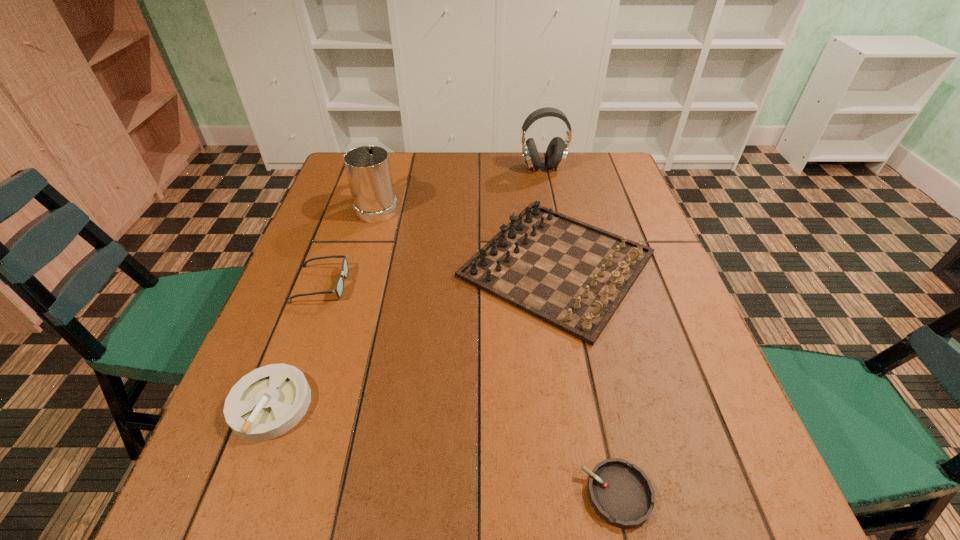
This screenshot has width=960, height=540. Find the location of `vacant space located 0.070m on the side of the mug with the handle`. vacant space located 0.070m on the side of the mug with the handle is located at coordinates pos(386,176).

Identify the location of free location located on the side of the mug with the handle. This screenshot has width=960, height=540. (385, 179).

I want to click on vacant space situated on the front of the third tallest object, so click(x=578, y=375).

Locate an element on the screen. The image size is (960, 540). vacant space positioned on the face of the spectacles is located at coordinates (372, 284).

Image resolution: width=960 pixels, height=540 pixels. Find the location of `vacant space located 0.150m on the right of the left ashtray`. vacant space located 0.150m on the right of the left ashtray is located at coordinates (392, 404).

Where is `vacant space situated 0.150m on the left of the right ashtray`? vacant space situated 0.150m on the left of the right ashtray is located at coordinates click(487, 494).

In order to click on headset located at the far edge in this screenshot , I will do (556, 153).

This screenshot has height=540, width=960. What are the coordinates of `mug at the far edge` in the screenshot? It's located at (368, 170).

I want to click on object that is at the near edge, so click(x=621, y=494).

This screenshot has height=540, width=960. In order to click on mug that is at the left edge in this screenshot , I will do `click(368, 170)`.